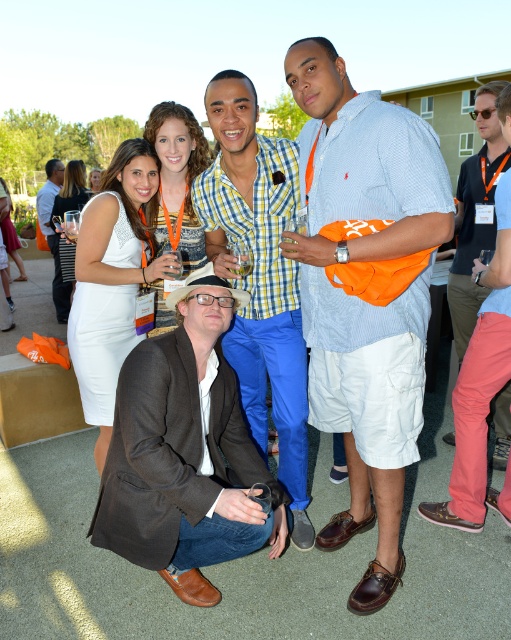
In the scene shown: You are standing in the outdoor gathering and want to reach both the point at coordinates point (x=398, y=163) and point (x=43, y=228). Which point should you go to first to minimize the total distance walked?

You should go to point (x=398, y=163) first because it is closer to you than point (x=43, y=228), so going there first minimizes the total distance walked.

You are a photographer trying to capture a clear shot of the light blue woven shirt at center and the brown leather jacket at lower center. Which one is blocking the other from view?

The light blue woven shirt at center is blocking the brown leather jacket at lower center because it is positioned in front of it.